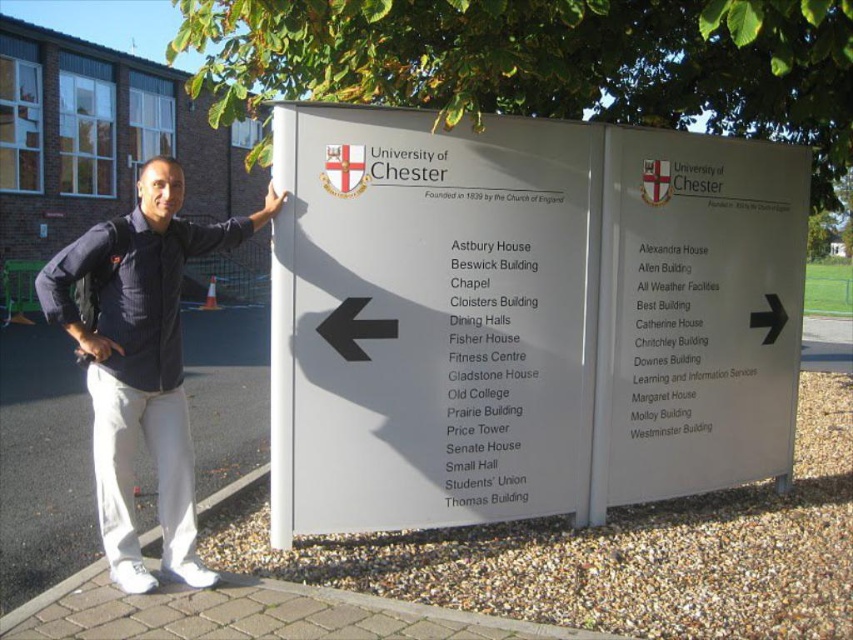
Question: Considering the relative positions of white plastic sign at center and dark blue shirt at upper left in the image provided, where is white plastic sign at center located with respect to dark blue shirt at upper left?

Choices:
 (A) right
 (B) left

Answer: (A)

Question: Which point is farther from the camera taking this photo?

Choices:
 (A) (167, 342)
 (B) (697, 342)

Answer: (B)

Question: Among these points, which one is farthest from the camera?

Choices:
 (A) (691, 458)
 (B) (608, 436)
 (C) (100, 337)

Answer: (A)

Question: Does white plastic sign at center have a smaller size compared to dark blue shirt at upper left?

Choices:
 (A) no
 (B) yes

Answer: (A)

Question: Which object is the farthest from the white plastic sign at center?

Choices:
 (A) dark blue shirt at upper left
 (B) white matte sign at right

Answer: (A)

Question: From the image, what is the correct spatial relationship of white plastic sign at center in relation to white matte sign at right?

Choices:
 (A) above
 (B) below

Answer: (A)